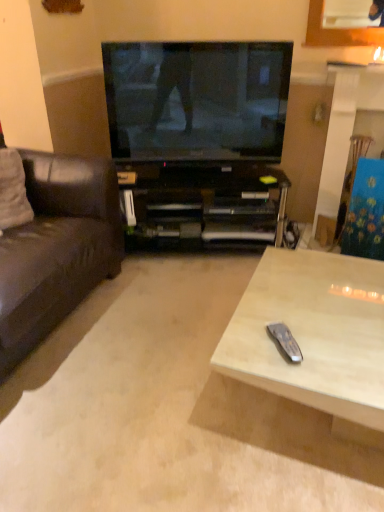
Image resolution: width=384 pixels, height=512 pixels. Find the location of `free space to the left of silver metallic remote at lower right`. free space to the left of silver metallic remote at lower right is located at coordinates (244, 350).